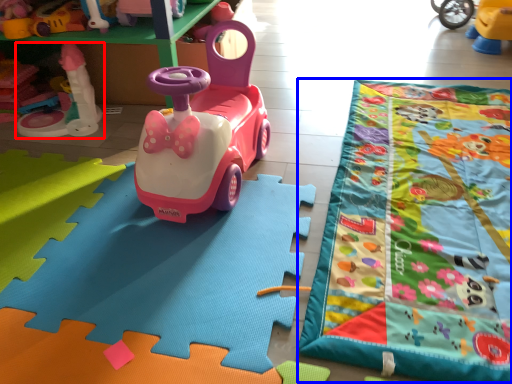
Question: Among these objects, which one is nearest to the camera, toy (highlighted by a red box) or blanket (highlighted by a blue box)?

Choices:
 (A) toy
 (B) blanket

Answer: (B)